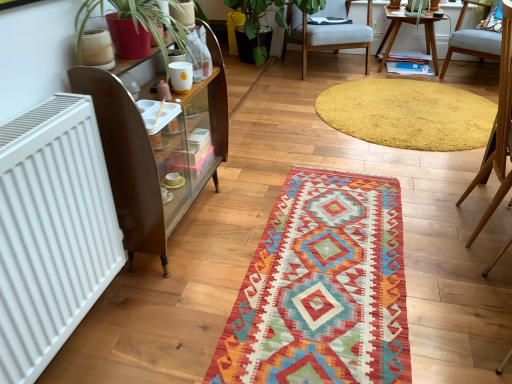
Where is `blank area beneath brown wooden shelf at left (from a real-world perspective)`? blank area beneath brown wooden shelf at left (from a real-world perspective) is located at coordinates (191, 221).